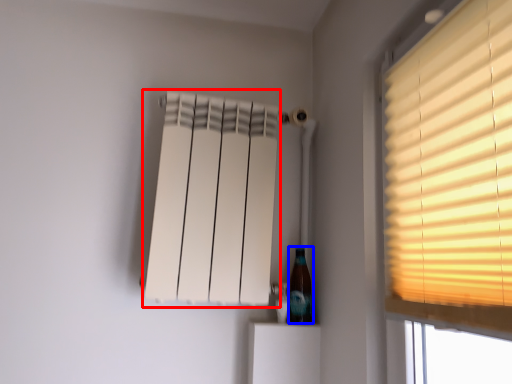
Question: Which of the following is the closest to the observer, curtain (highlighted by a red box) or bottle (highlighted by a blue box)?

Choices:
 (A) curtain
 (B) bottle

Answer: (A)